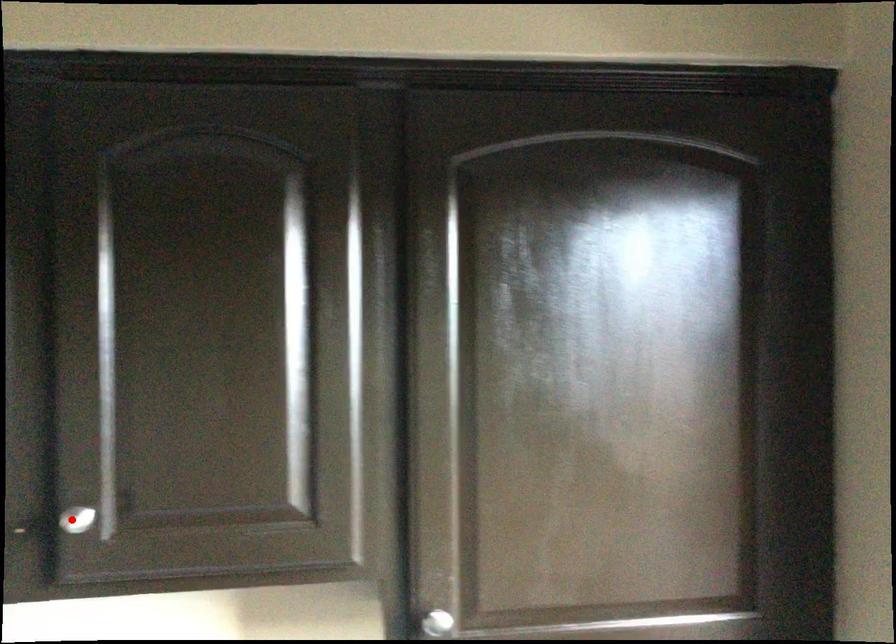
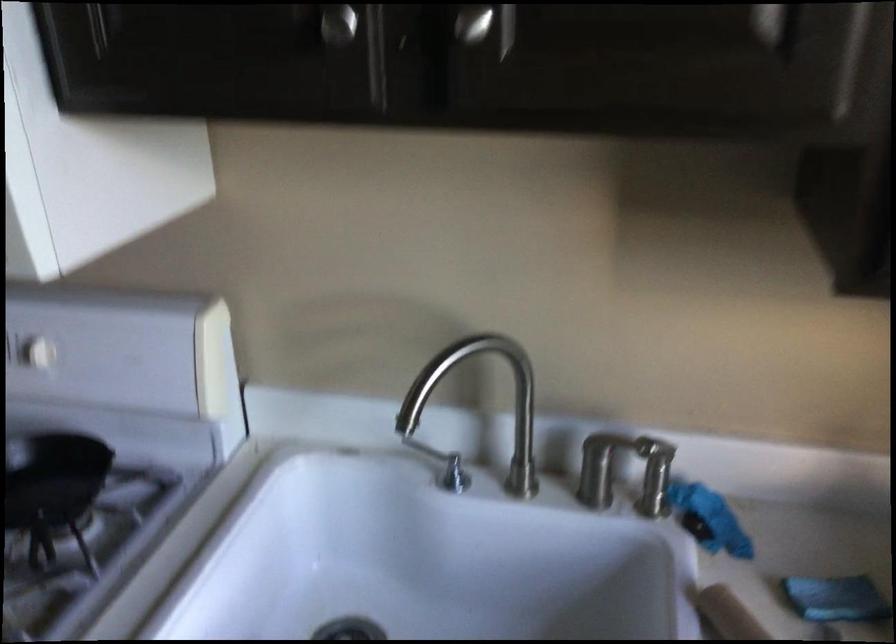
Where in the second image is the point corresponding to the highlighted location from the first image?

(472, 23)